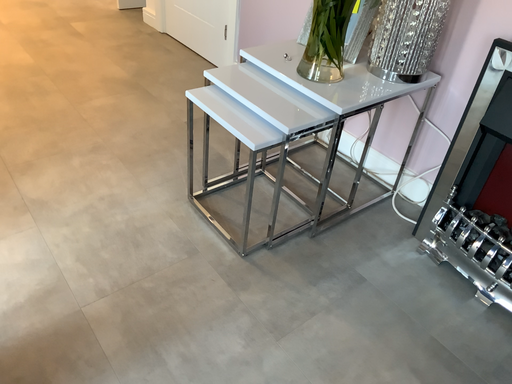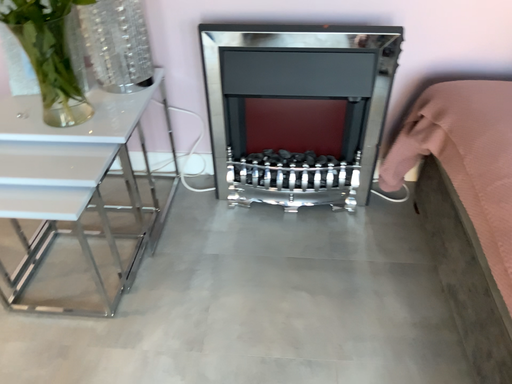
Question: Which way did the camera rotate in the video?

Choices:
 (A) rotated downward
 (B) rotated upward

Answer: (B)